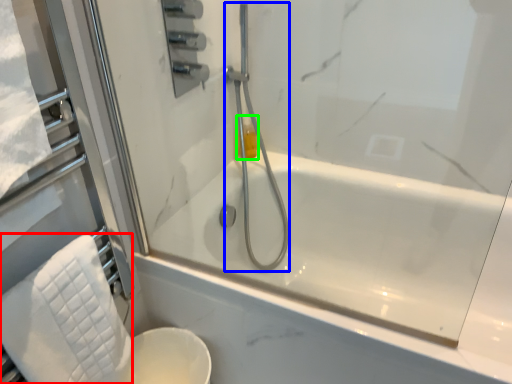
Question: Which object is positioned closest to bath towel (highlighted by a red box)? Select from shower (highlighted by a blue box) and toiletry (highlighted by a green box).

Choices:
 (A) shower
 (B) toiletry

Answer: (A)